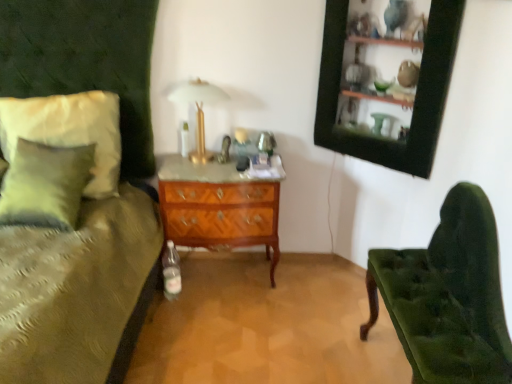
Where is `vacant area to the right of woodenwoodenchest of drawers at center`? vacant area to the right of woodenwoodenchest of drawers at center is located at coordinates (310, 289).